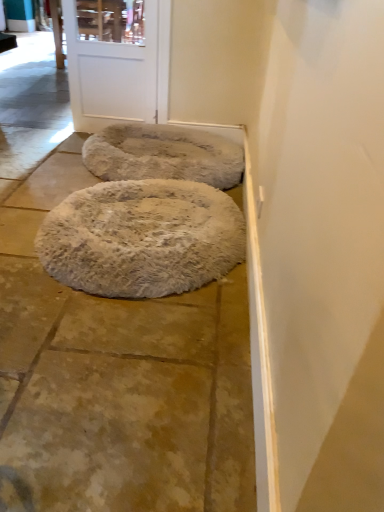
This screenshot has width=384, height=512. Find the location of `vacant area that lies in front of white fluffy dog bed at center, the second dog bed viewed from the back`. vacant area that lies in front of white fluffy dog bed at center, the second dog bed viewed from the back is located at coordinates (123, 367).